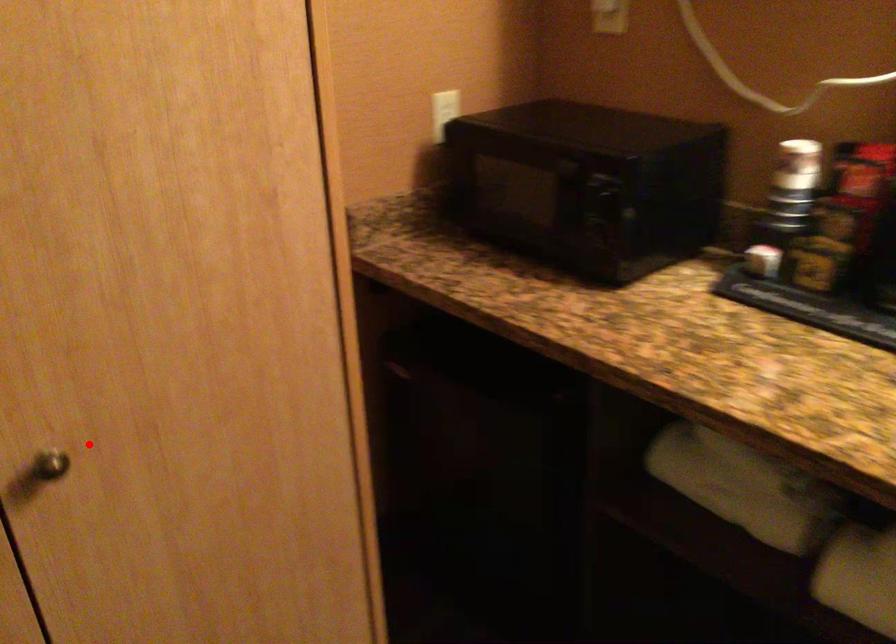
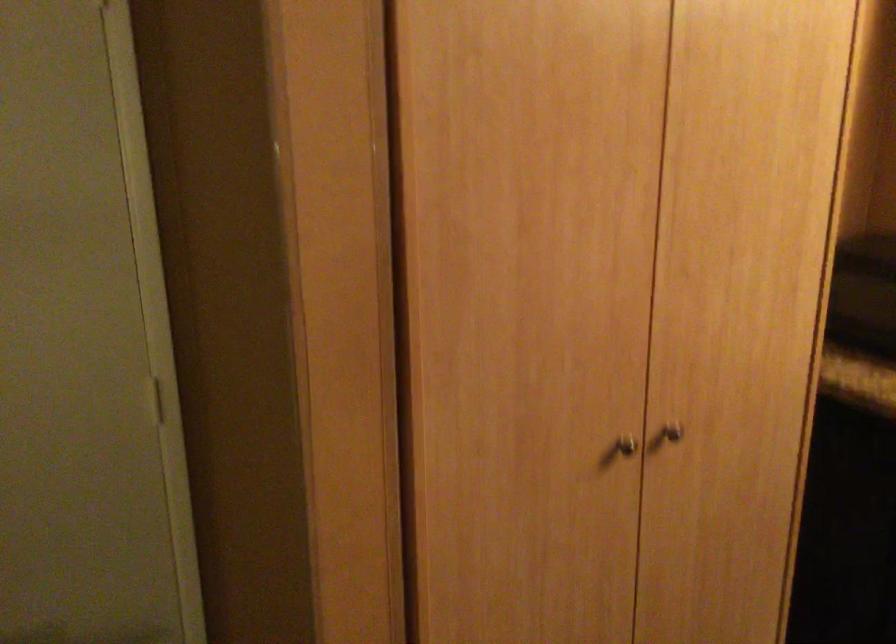
Question: I am providing you with two images of the same scene from different viewpoints. Given a red point in image1, look at the same physical point in image2. Is it:

Choices:
 (A) Closer to the viewpoint
 (B) Farther from the viewpoint

Answer: (B)